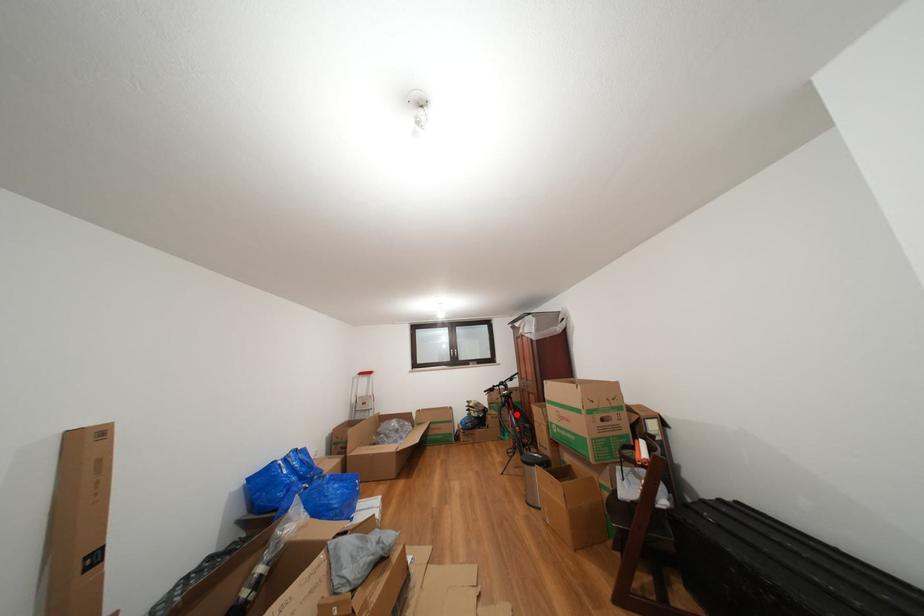
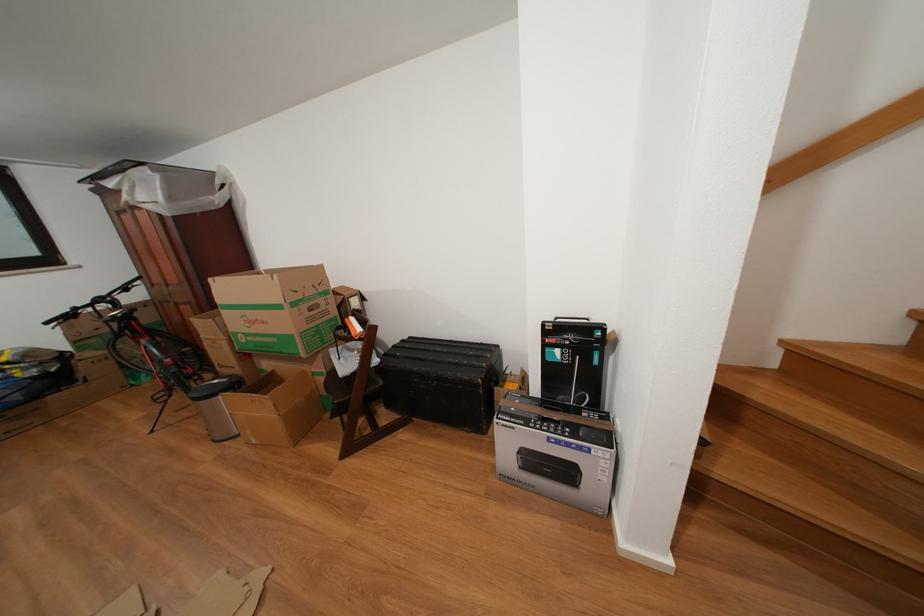
Locate, in the second image, the point that corresponds to the highlighted location in the first image.

(143, 344)